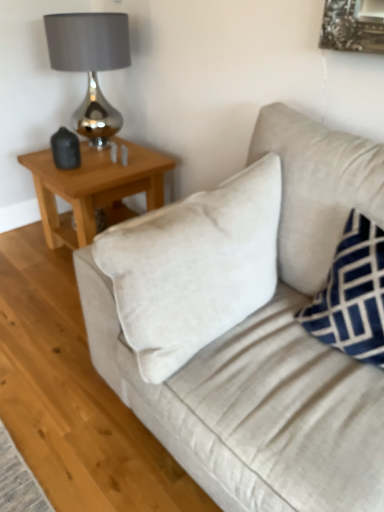
Question: Is blue velvet pillow at right taller or shorter than beige fabric couch at center?

Choices:
 (A) tall
 (B) short

Answer: (B)

Question: Considering the positions of point (344, 317) and point (195, 361), is point (344, 317) closer or farther from the camera than point (195, 361)?

Choices:
 (A) closer
 (B) farther

Answer: (B)

Question: Estimate the real-world distances between objects in this image. Which object is farther from the blue velvet pillow at right?

Choices:
 (A) light brown wooden table at upper left
 (B) shiny metallic lamp at upper left
 (C) beige fabric couch at center

Answer: (B)

Question: Based on their relative distances, which object is farther from the light brown wooden table at upper left?

Choices:
 (A) blue velvet pillow at right
 (B) beige fabric couch at center
 (C) shiny metallic lamp at upper left

Answer: (A)